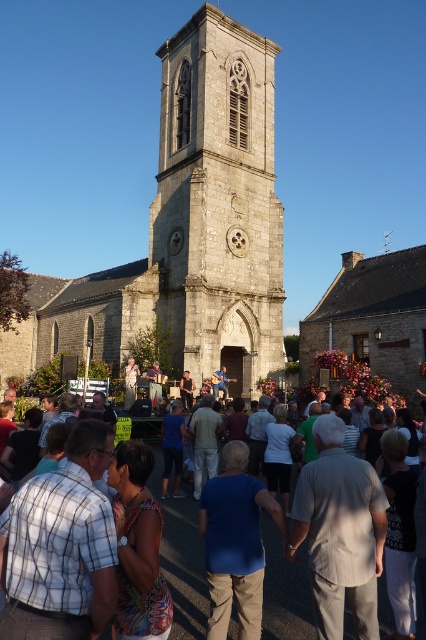
You are standing at point (189, 228) in the image. What structure is directly beneath your feet?

The stone church at center is located at point (189, 228), so the structure directly beneath your feet is the stone church at center.

You are a photographer standing in front of the stone church at center and the white cotton crowd at center. You want to take a photo that includes both the church and the crowd. Which object should you focus on first to ensure both are in frame?

The stone church at center is much taller than the white cotton crowd at center, so you should focus on the stone church at center first to ensure both are in frame.

You are standing at the entrance of the park and want to find the stone church at center. According to the map, your current position is at point A, and the church is marked at point B. If the coordinates of point B are given as 0.358, 0.444, can you determine the direction you should head to reach the church?

The stone church at center is located at point (x=189, y=228), so you should head towards that coordinate to reach it.